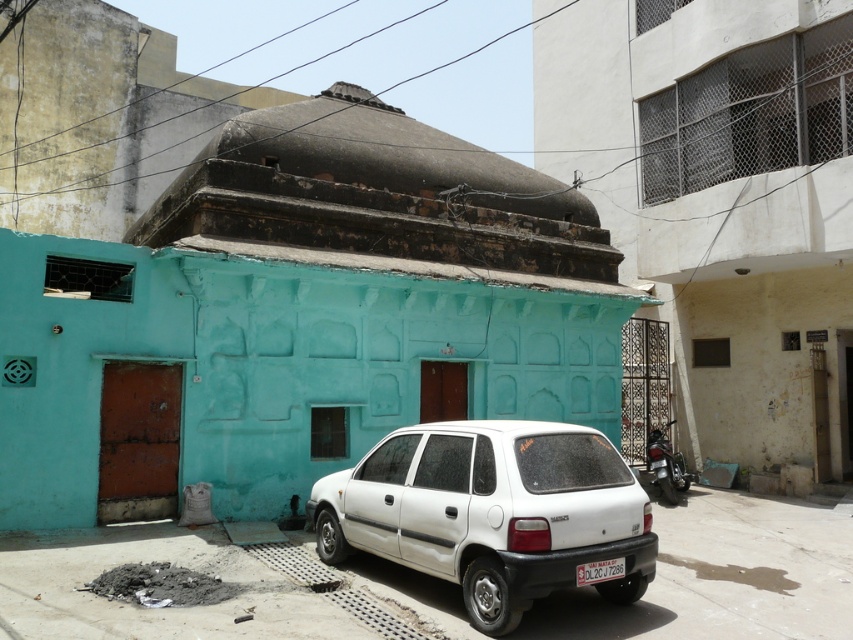
Locate an element on the screen. white matte hatchback at center is located at coordinates click(x=491, y=512).

Can you confirm if white matte hatchback at center is thinner than white plastic license plate at lower center?

In fact, white matte hatchback at center might be wider than white plastic license plate at lower center.

Between point (532, 536) and point (592, 576), which one is positioned in front?

Point (532, 536) is in front.

At what (x,y) coordinates should I click in order to perform the action: click on white matte hatchback at center. Please return your answer as a coordinate pair (x, y). Looking at the image, I should click on (491, 512).

Looking at this image, who is more distant from viewer, (416, 465) or (672, 484)?

Positioned behind is point (672, 484).

Is white matte hatchback at center shorter than shiny metallic motorcycle at right?

In fact, white matte hatchback at center may be taller than shiny metallic motorcycle at right.

Is point (508, 602) farther from camera compared to point (659, 451)?

No, it is not.

This screenshot has height=640, width=853. In order to click on white matte hatchback at center in this screenshot , I will do `click(491, 512)`.

Can you confirm if shiny metallic motorcycle at right is positioned to the right of white plastic license plate at lower center?

Correct, you'll find shiny metallic motorcycle at right to the right of white plastic license plate at lower center.

Which of these two, shiny metallic motorcycle at right or white plastic license plate at lower center, stands taller?

With more height is shiny metallic motorcycle at right.

Is point (674, 500) less distant than point (624, 573)?

No, it is behind (624, 573).

The width and height of the screenshot is (853, 640). In order to click on shiny metallic motorcycle at right in this screenshot , I will do `click(666, 465)`.